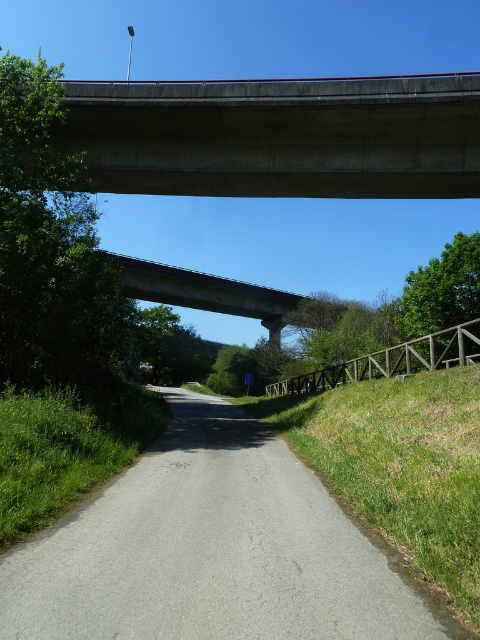
You are a delivery truck driver who needs to cross the road. The truck is 3 meters wide. There are two concrete structures ahead. The first is the concrete at upper center and the second is the concrete bridge at center. Can you safely drive through both structures?

The concrete at upper center has a width less than the concrete bridge at center. Since the truck is 3 meters wide, you need to check if both structures are wider than 3 meters. However, since the concrete bridge at center is wider than the concrete at upper center, but we don not know their exact widths. Therefore, it is uncertain if both can accommodate the truck. Please verify the minimum width requirements before proceeding.

You are standing at the point marked as point (210,548) in the image. What object is directly beneath your feet?

The gray asphalt road at center is located at point (210,548), so the object directly beneath your feet is the gray asphalt road at center.